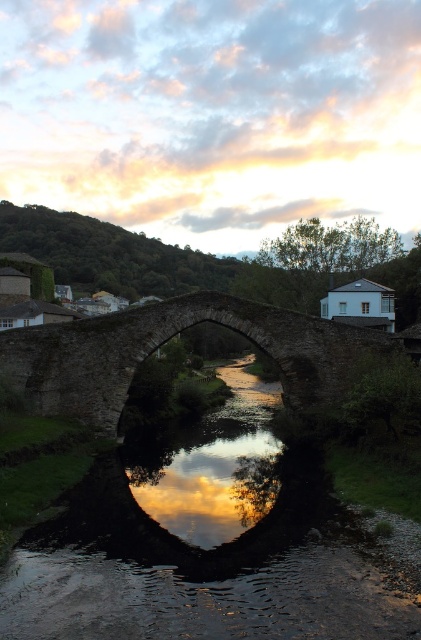
Looking at this image, you are standing on the stone arch bridge at center and want to see your reflection in the reflective stone river at center. Can you see your reflection clearly?

The reflective stone river at center is closer to the viewer than the stone arch bridge at center, so yes, you can see your reflection clearly in the reflective stone river at center because it is positioned in front of the bridge.

You are an architect analyzing the proportions of the scene. Given that the stone arch bridge at center is taller than the reflective stone river at center, which object would cast a longer shadow on the ground? Please explain your reasoning based on their heights.

The stone arch bridge at center would cast a longer shadow on the ground because it is taller than the reflective stone river at center. Taller objects generally cast longer shadows when the light source, like the sun, is at a low angle such as during sunrise or sunset.

You are standing on the stone arch bridge at center and looking down. What do you see reflected in the reflective stone river at center?

You see the stone arch bridge at center reflected in the reflective stone river at center because the river is located below the bridge and acts as a mirror surface.